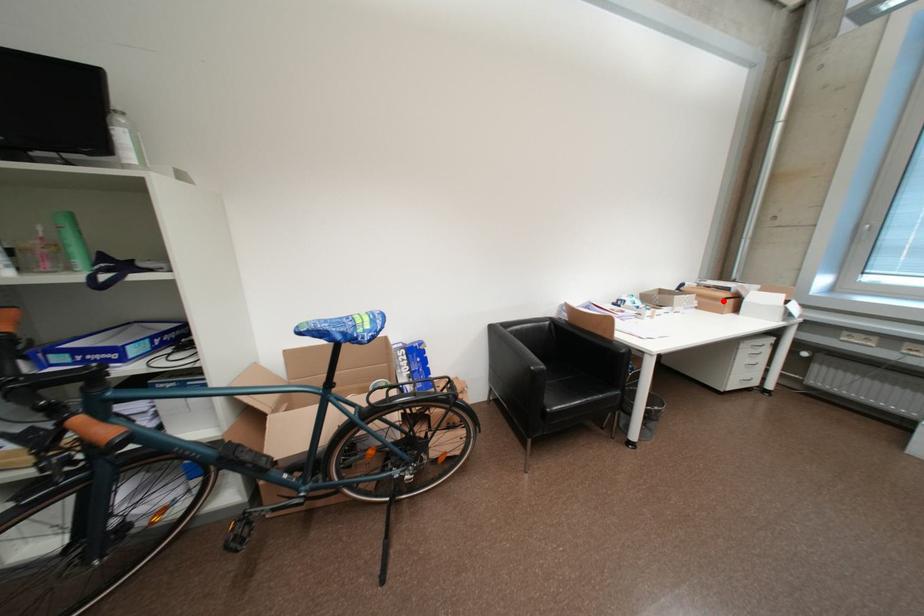
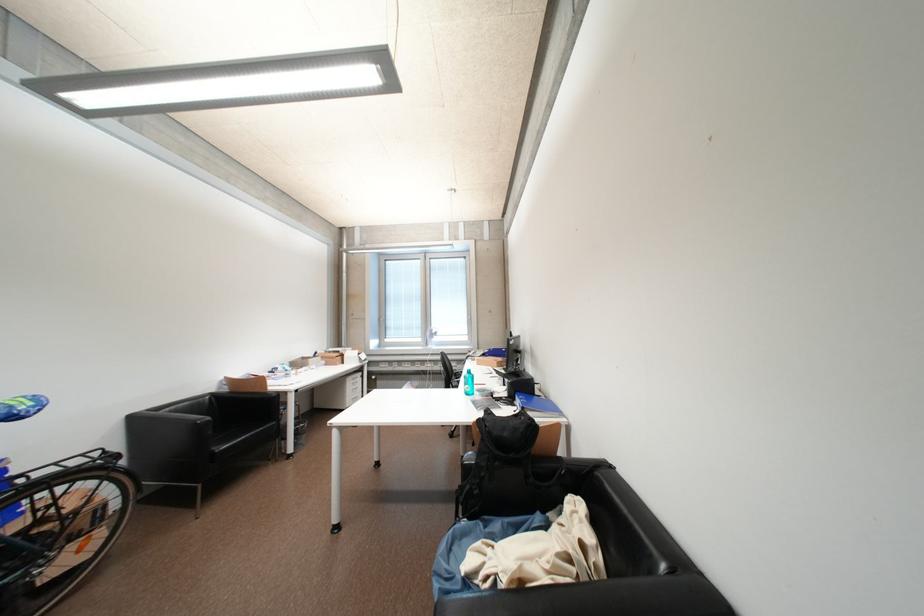
Question: I am providing you with two images of the same scene from different viewpoints. Image1 has a red point marked. In image2, the corresponding 3D location appears at what relative position? Reply with the corresponding letter.

Choices:
 (A) Closer
 (B) Farther

Answer: (B)